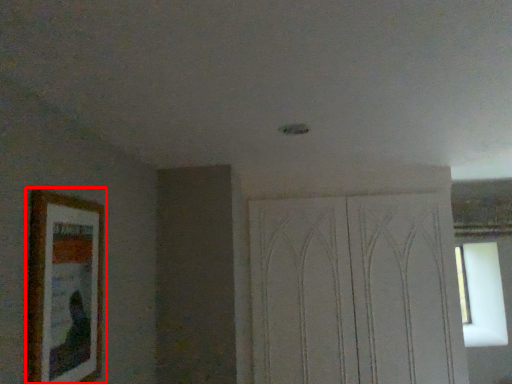
Question: Where is picture frame (annotated by the red box) located in relation to screen door in the image?

Choices:
 (A) right
 (B) left

Answer: (B)